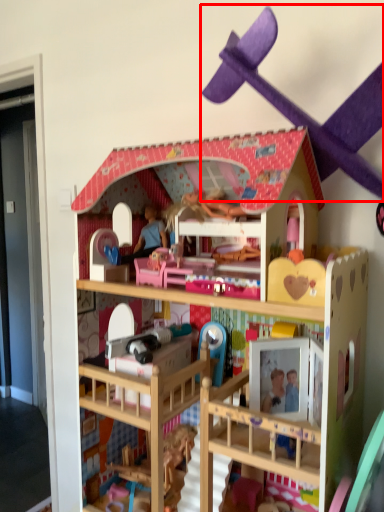
Question: From the image's perspective, what is the correct spatial positioning of toy (annotated by the red box) in reference to toy?

Choices:
 (A) above
 (B) below

Answer: (A)